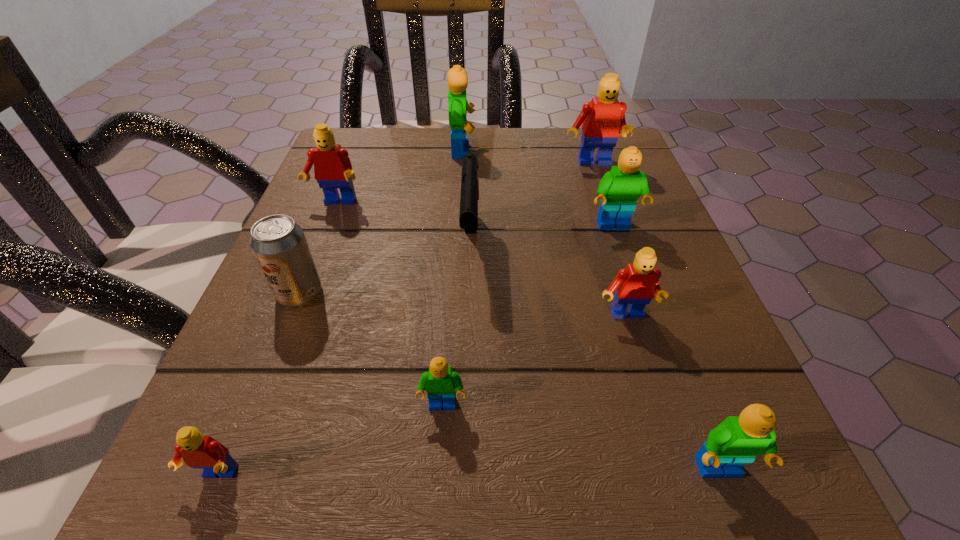
Where is `the third biggest green Lego`? The height and width of the screenshot is (540, 960). the third biggest green Lego is located at coordinates (737, 440).

The width and height of the screenshot is (960, 540). I want to click on the smallest green Lego, so click(440, 382).

Where is `the eighth farthest object`? Image resolution: width=960 pixels, height=540 pixels. the eighth farthest object is located at coordinates (440, 382).

I want to click on the nearest red Lego, so tap(199, 452).

Where is `free space located 0.340m on the face of the biggest green Lego`? free space located 0.340m on the face of the biggest green Lego is located at coordinates (631, 151).

This screenshot has height=540, width=960. Identify the location of vacant region located 0.100m on the front-facing side of the farthest red Lego. (604, 200).

Identify the location of vacant area located 0.370m on the front-facing side of the third nearest red Lego. The height and width of the screenshot is (540, 960). click(263, 389).

Image resolution: width=960 pixels, height=540 pixels. I want to click on vacant space located 0.110m on the face of the fourth farthest Lego, so click(633, 280).

Where is `free space located 0.140m at the barrel of the pistol`? free space located 0.140m at the barrel of the pistol is located at coordinates (468, 357).

Image resolution: width=960 pixels, height=540 pixels. Identify the location of vacant point located on the back of the beer can. (338, 196).